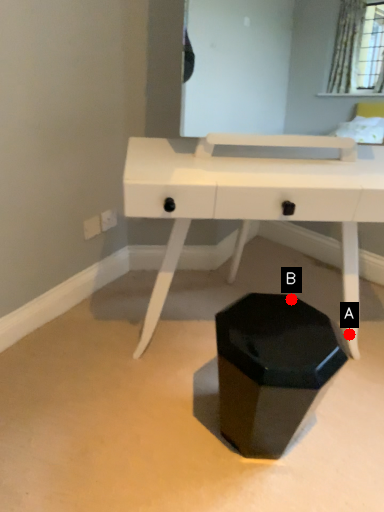
Question: Two points are circled on the image, labeled by A and B beside each circle. Among these points, which one is nearest to the camera?

Choices:
 (A) A is closer
 (B) B is closer

Answer: (B)